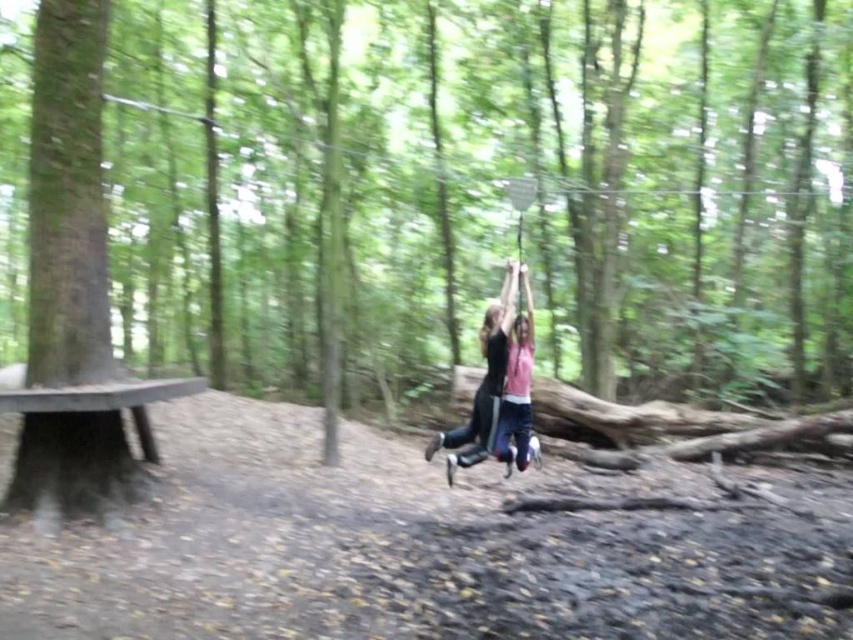
You are planning to set up a picnic for four people. You see a dark brown wooden picnic table at lower left and a black fabric swing at center. Which object can accommodate more people comfortably?

The dark brown wooden picnic table at lower left has a larger width than the black fabric swing at center, so it can accommodate more people comfortably.

You are planning to place a new bench in the forest scene so that it is between the dark brown wooden picnic table at lower left and the black fabric swing at center. Given their positions, where should the bench be placed relative to the picnic table?

The bench should be placed above the dark brown wooden picnic table at lower left since it is located below the black fabric swing at center.